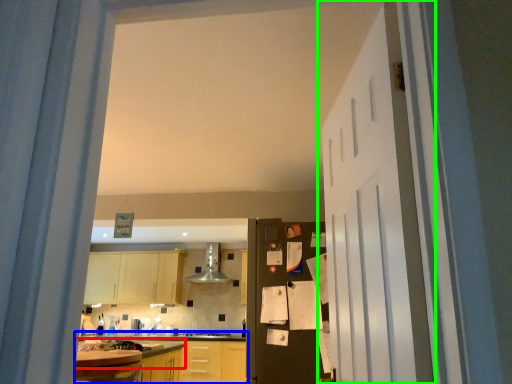
Question: Which object is positioned farthest from countertop (highlighted by a red box)? Select from countertop (highlighted by a blue box) and door (highlighted by a green box).

Choices:
 (A) countertop
 (B) door

Answer: (B)